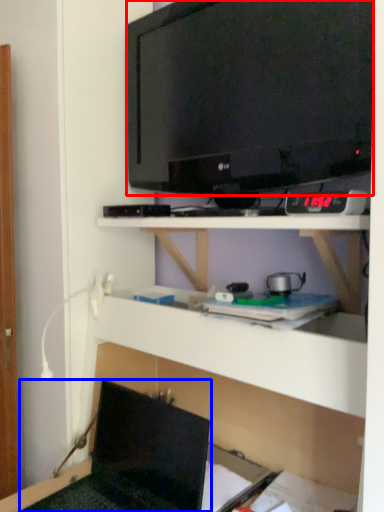
Question: Which object appears closest to the camera in this image, television (highlighted by a red box) or laptop (highlighted by a blue box)?

Choices:
 (A) television
 (B) laptop

Answer: (B)